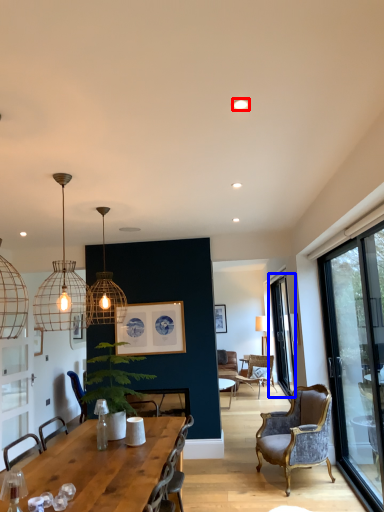
Question: Which point is further to the camera, lighting (highlighted by a red box) or window (highlighted by a blue box)?

Choices:
 (A) lighting
 (B) window

Answer: (B)